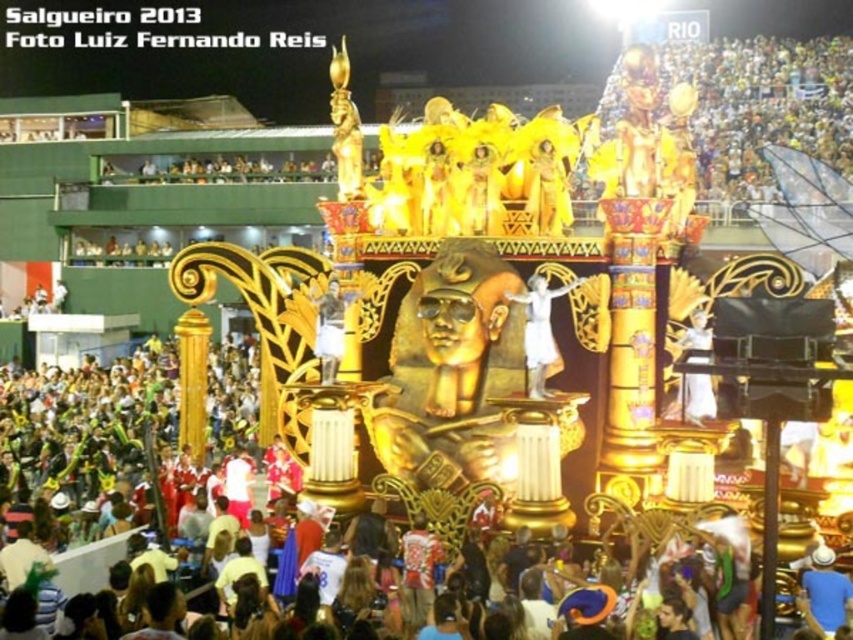
You are a photographer at the carnival parade. You want to capture a photo where both the white satin dress at center and the golden statue at center are visible. Based on their positions, which object should you ensure is in the foreground to include both in the frame?

The white satin dress at center is located below the golden statue at center, so to include both in the frame, ensure the golden statue at center is in the foreground.

Based on the provided coordinates, where is the golden statue at center located in the image?

The golden statue at center is located at point coordinates of (695, 397).

You are a photographer at the carnival parade and want to capture the float with both the point at (537,304) and the point at (329,296) in your shot. Which point should you focus on first to ensure both are in frame?

You should focus on point (537,304) first because it is closer to the viewer than point (329,296), ensuring both points remain in the frame.